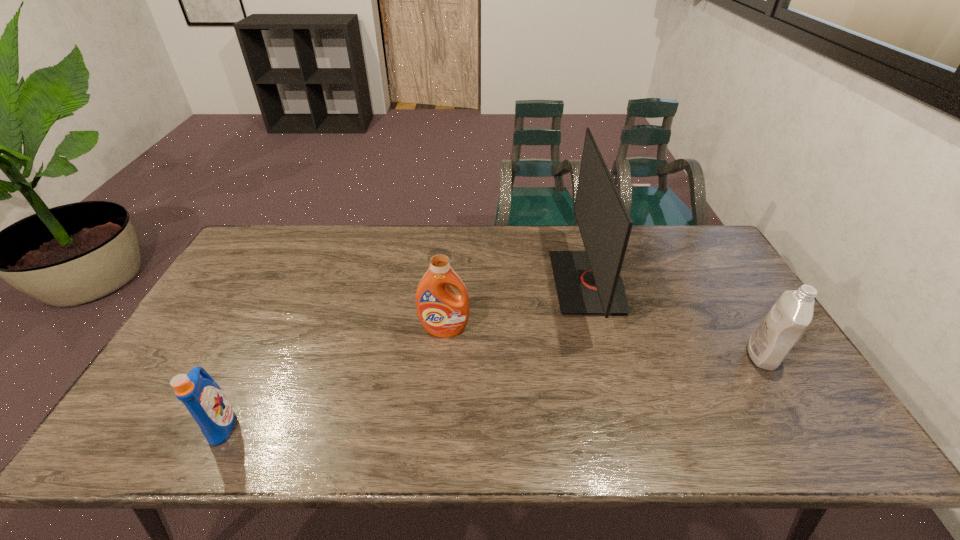
This screenshot has height=540, width=960. Identify the location of vacant space situated on the screen side of the monitor. (481, 282).

Image resolution: width=960 pixels, height=540 pixels. Identify the location of free space located on the front-facing side of the farthest detergent. (437, 430).

Locate an element on the screen. The height and width of the screenshot is (540, 960). blank area located 0.210m on the front of the rightmost object is located at coordinates 822,452.

Locate an element on the screen. This screenshot has height=540, width=960. vacant space located 0.350m on the label of the nearest object is located at coordinates (387, 424).

In order to click on object positioned at the far edge in this screenshot , I will do `click(587, 282)`.

Locate an element on the screen. object that is at the near edge is located at coordinates (204, 399).

I want to click on object that is at the right edge, so click(x=785, y=323).

You are a GUI agent. You are given a task and a screenshot of the screen. Output one action in this format:
    pyautogui.click(x=<x>, y=<y>)
    Task: Click on the free location at the far edge
    This screenshot has width=960, height=540.
    Given the screenshot: What is the action you would take?
    pyautogui.click(x=384, y=256)

In order to click on free location at the near edge in this screenshot , I will do `click(688, 428)`.

In order to click on vacant space at the left edge in this screenshot , I will do `click(233, 308)`.